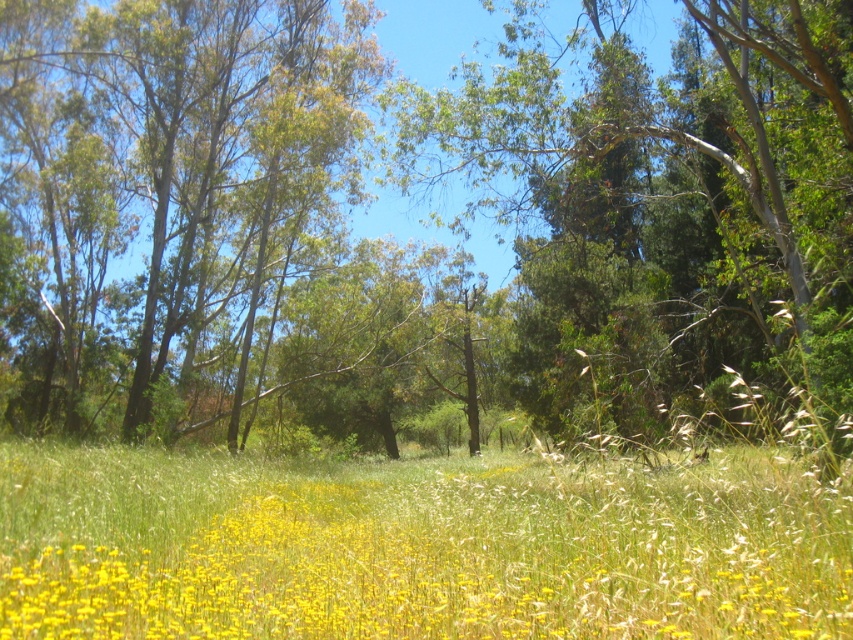
Question: From the image, what is the correct spatial relationship of green leafy tree at center in relation to green leafy tree at upper left?

Choices:
 (A) left
 (B) right

Answer: (B)

Question: Which point is farther from the camera taking this photo?

Choices:
 (A) (410, 596)
 (B) (183, 364)
 (C) (329, 97)

Answer: (B)

Question: Which of the following is the closest to the observer?

Choices:
 (A) green leafy tree at upper left
 (B) yellow grass at lower center
 (C) green leafy tree at center

Answer: (B)

Question: Is green leafy tree at center positioned before green leafy tree at upper left?

Choices:
 (A) yes
 (B) no

Answer: (A)

Question: Is green leafy tree at center closer to camera compared to green leafy tree at upper left?

Choices:
 (A) no
 (B) yes

Answer: (B)

Question: Estimate the real-world distances between objects in this image. Which object is closer to the green leafy tree at center?

Choices:
 (A) yellow grass at lower center
 (B) green leafy tree at upper left

Answer: (B)